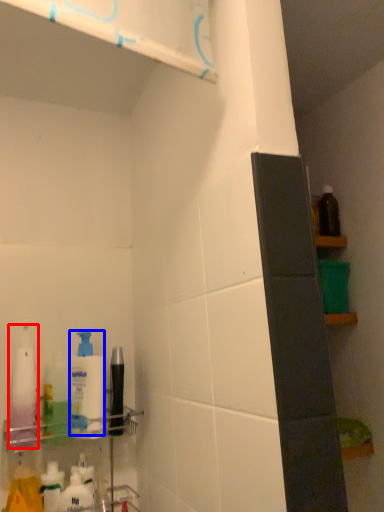
Question: Which point is closer to the camera, cleaning product (highlighted by a red box) or cleaning product (highlighted by a blue box)?

Choices:
 (A) cleaning product
 (B) cleaning product

Answer: (A)